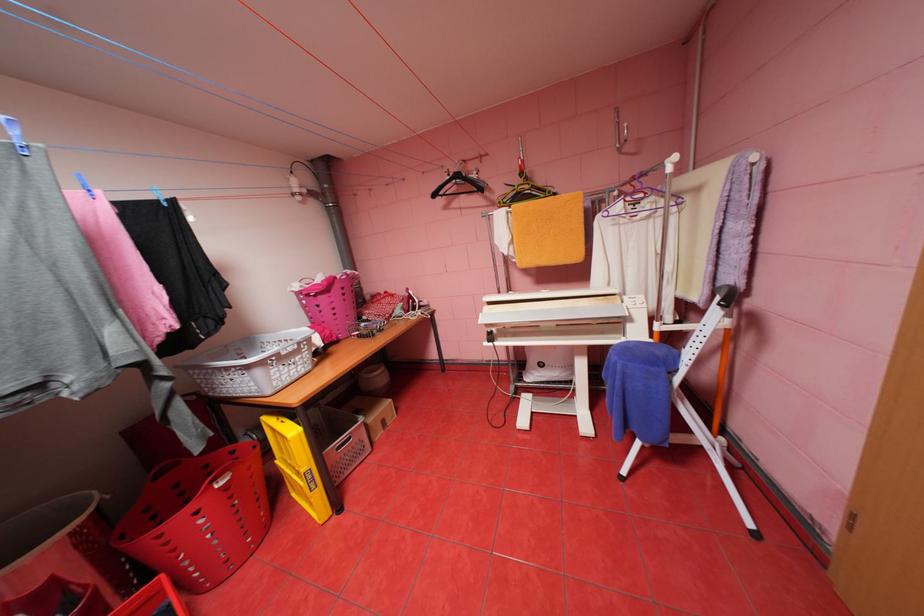
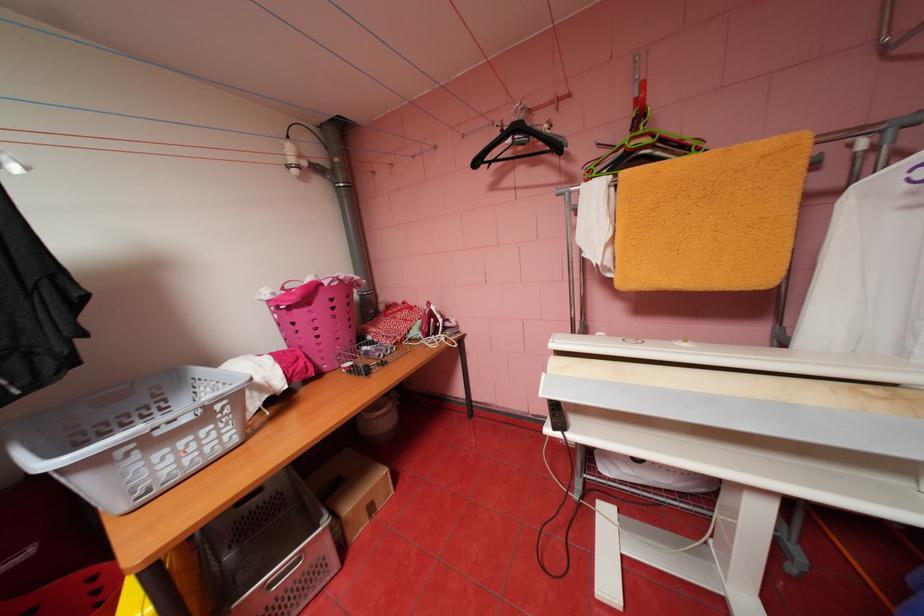
Where in the second image is the point corresponding to pixel 329 297 from the first image?

(304, 310)